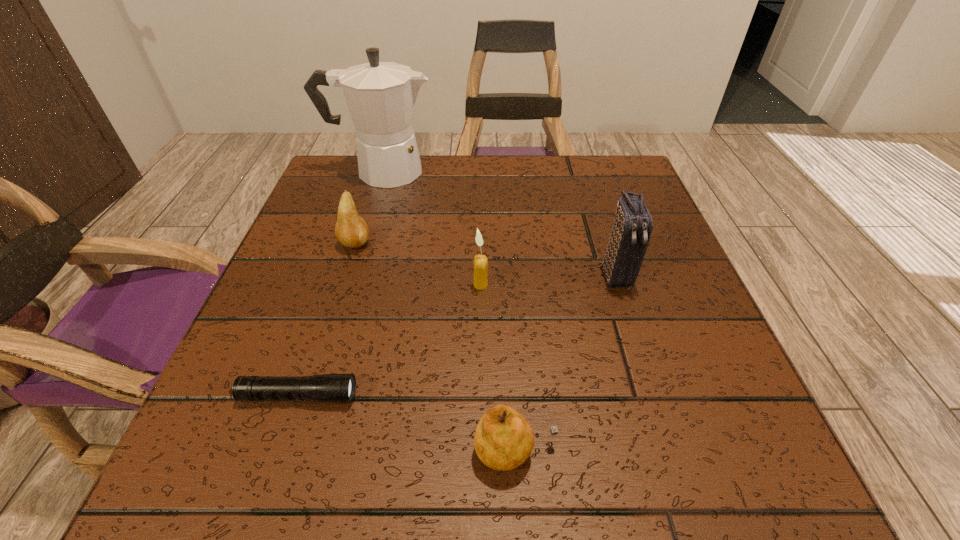
The image size is (960, 540). What are the coordinates of `the shortest object` in the screenshot? It's located at (337, 388).

Locate an element on the screen. This screenshot has width=960, height=540. vacant space located 0.130m at the spout of the tallest object is located at coordinates (488, 171).

Image resolution: width=960 pixels, height=540 pixels. I want to click on blank space located 0.310m with the zip open on the second tallest object, so click(x=678, y=470).

Where is `blank area located 0.130m on the back of the candle`? The width and height of the screenshot is (960, 540). blank area located 0.130m on the back of the candle is located at coordinates (480, 236).

The width and height of the screenshot is (960, 540). Find the location of `blank area located 0.390m on the front of the second farthest object`. blank area located 0.390m on the front of the second farthest object is located at coordinates (291, 448).

The width and height of the screenshot is (960, 540). I want to click on vacant space located 0.120m on the back of the shorter pear, so click(509, 353).

Find the location of `free region located 0.290m at the lens end of the fifth farthest object`. free region located 0.290m at the lens end of the fifth farthest object is located at coordinates (555, 396).

Locate an element on the screen. The image size is (960, 540). object that is at the far edge is located at coordinates (381, 96).

This screenshot has width=960, height=540. Find the location of `object situated at the near edge`. object situated at the near edge is located at coordinates (503, 440).

Find the location of a particular element. coffeepot located in the left edge section of the desktop is located at coordinates (381, 96).